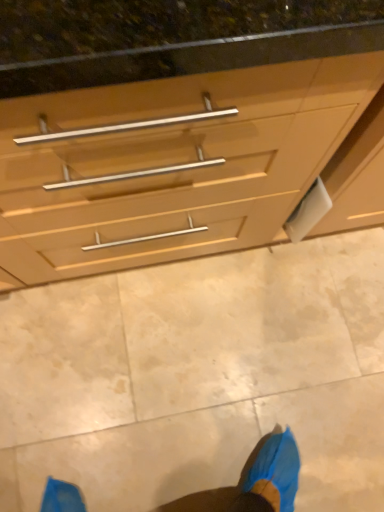
The image size is (384, 512). Identify the location of matte wood chest of drawers at upper center. (184, 165).

What is the approximate width of matte wood chest of drawers at upper center?

It is 25.83 inches.

What do you see at coordinates (184, 165) in the screenshot? This screenshot has height=512, width=384. I see `matte wood chest of drawers at upper center` at bounding box center [184, 165].

Locate an element on the screen. matte wood chest of drawers at upper center is located at coordinates (184, 165).